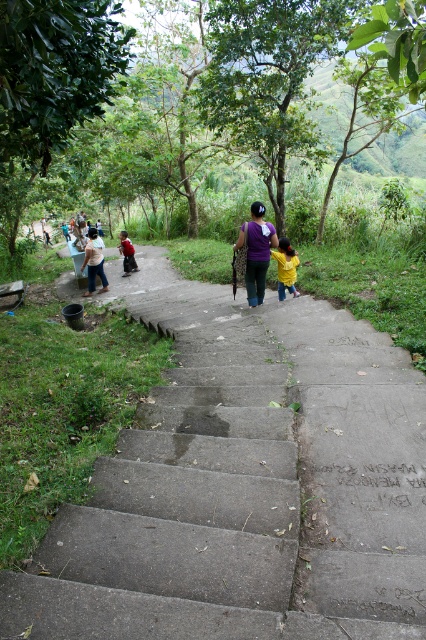
You are a hiker trying to determine the best path up the hill. You notice the concrete stairs at center and the purple fabric at center in the image. Which object is shorter in height?

The concrete stairs at center is not as tall as the purple fabric at center, so the concrete stairs at center is shorter in height.

You are standing at the bottom of the stairs and want to reach the top. Given that the concrete stairs at center are located at point 0.798, 0.420, can you estimate how many steps you need to climb to reach the top?

The concrete stairs at center are located at point (178, 509), but without additional information about the total number of steps or their height, it is impossible to accurately estimate the number of steps needed to reach the top.